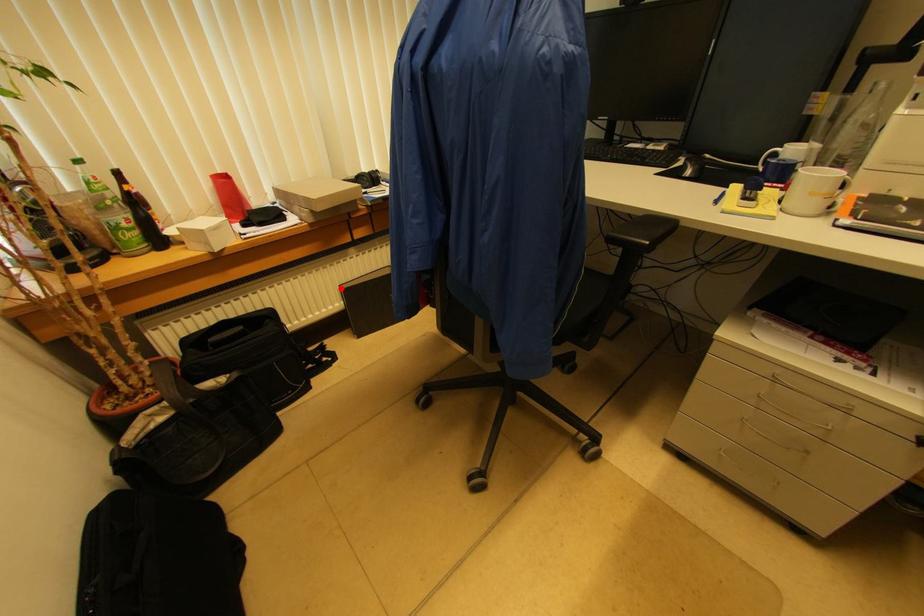
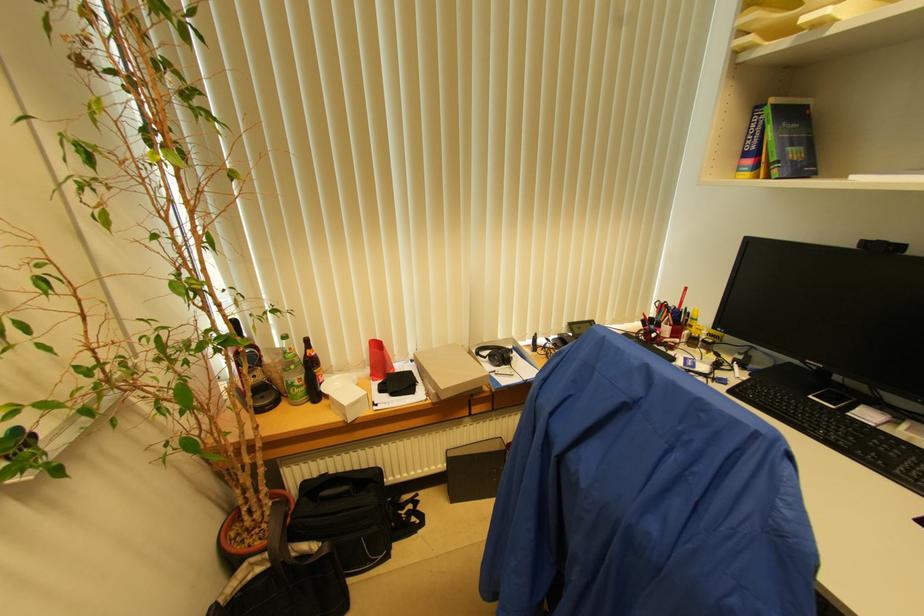
Question: A red point is marked in image1. In image2, is the corresponding 3D point closer to the camera or farther? Reply with the corresponding letter.

Choices:
 (A) The corresponding 3D point is closer.
 (B) The corresponding 3D point is farther.

Answer: (B)